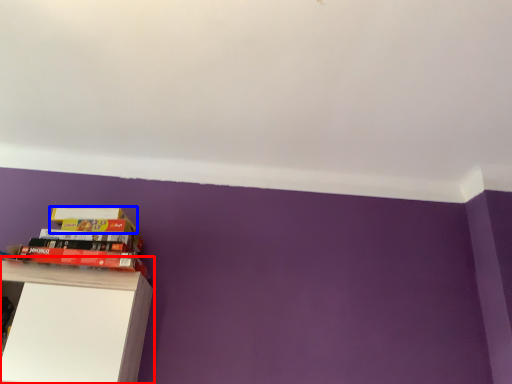
Question: Which point is further to the camera, shelf (highlighted by a red box) or paperback book (highlighted by a blue box)?

Choices:
 (A) shelf
 (B) paperback book

Answer: (B)